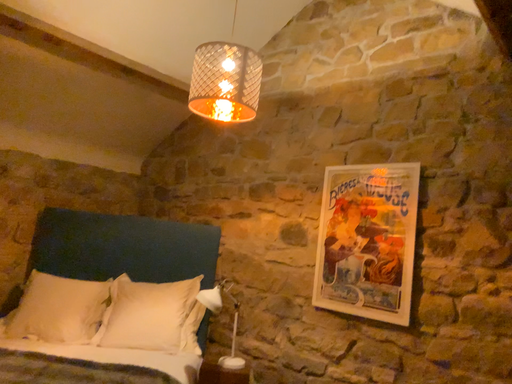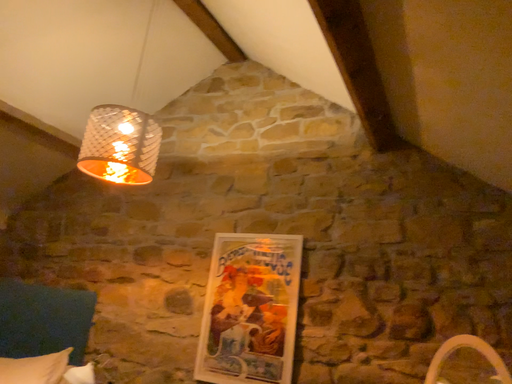
Question: How did the camera likely rotate when shooting the video?

Choices:
 (A) rotated right
 (B) rotated left

Answer: (A)